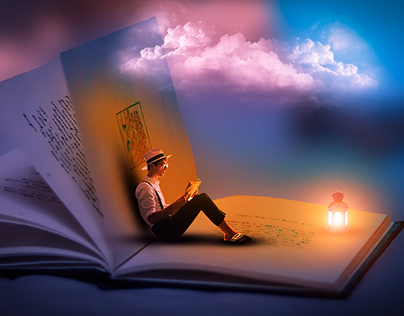
Where is `lantern`? lantern is located at coordinates (338, 220).